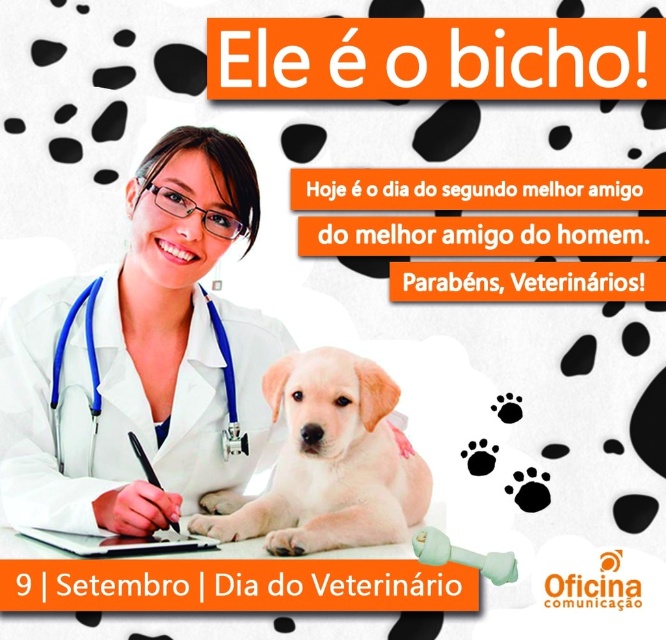
Question: Is white lab coat at center above light brown fur puppy at center?

Choices:
 (A) no
 (B) yes

Answer: (B)

Question: Which object is positioned closest to the white lab coat at center?

Choices:
 (A) light brown fur puppy at center
 (B) blue fabric stethoscope at lower left

Answer: (B)

Question: Does light brown fur puppy at center appear on the right side of blue fabric stethoscope at lower left?

Choices:
 (A) yes
 (B) no

Answer: (A)

Question: Which object is the closest to the white lab coat at center?

Choices:
 (A) light brown fur puppy at center
 (B) blue fabric stethoscope at lower left

Answer: (B)

Question: Which point is farther to the camera?

Choices:
 (A) blue fabric stethoscope at lower left
 (B) white lab coat at center
 (C) light brown fur puppy at center

Answer: (A)

Question: Is light brown fur puppy at center positioned behind blue fabric stethoscope at lower left?

Choices:
 (A) no
 (B) yes

Answer: (A)